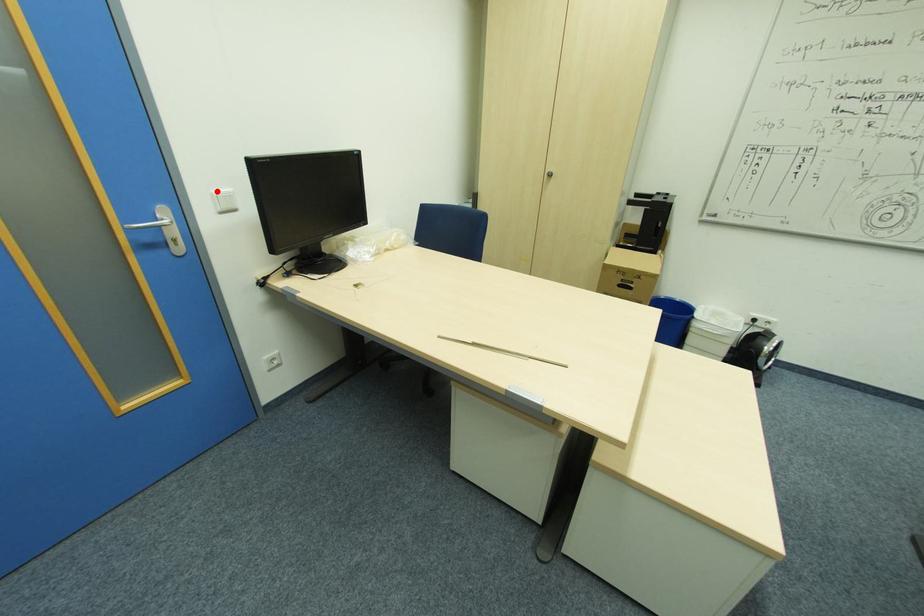
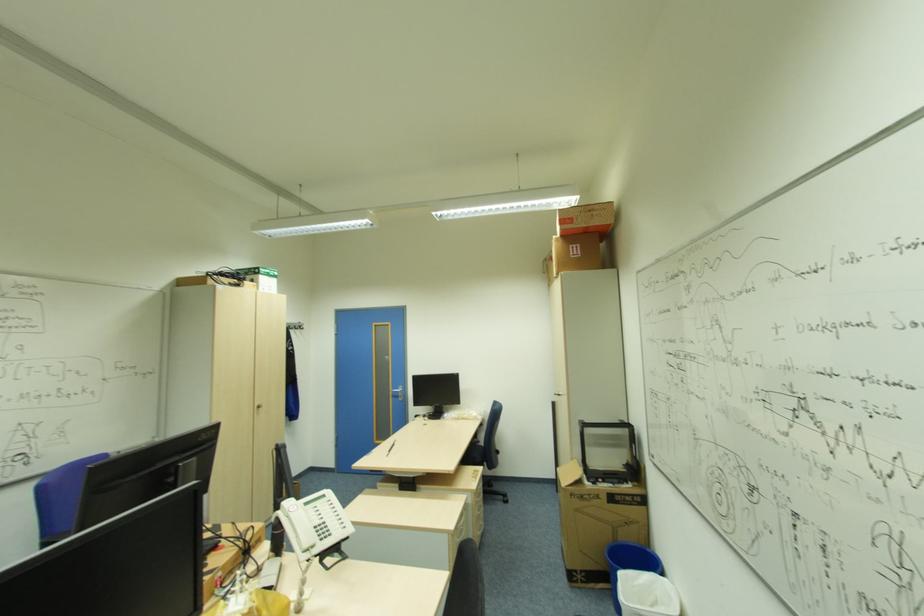
Question: I am providing you with two images of the same scene from different viewpoints. A red point is marked on the first image. Is the red point's position out of view in image 2?

Choices:
 (A) Yes
 (B) No

Answer: (A)